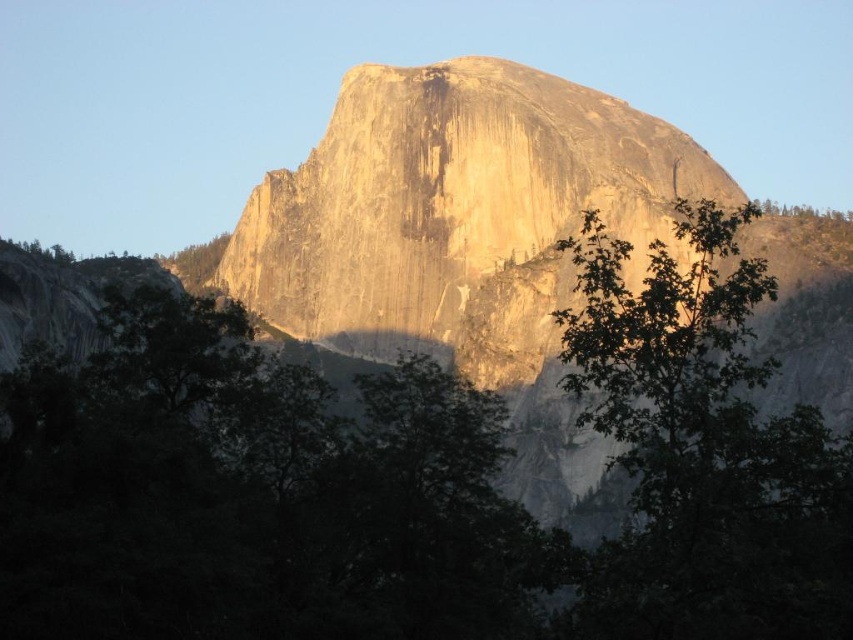
You are a photographer planning to capture the yellowish rock at center and the green leafy tree at right in a single frame. Based on their sizes, which object would occupy more space in the photo?

The yellowish rock at center would occupy more space in the photo since its width surpasses that of the green leafy tree at right according to the description.

You are standing in front of the majestic natural landscape with the large granite dome mountain. You notice a green leafy tree at center. Based on its position, can you determine if the tree is closer to you or further away compared to the mountain?

The green leafy tree at center is located at point coordinates that place it closer to the viewer than the mountain, so the tree is closer.

You are a hiker standing at the base of Half Dome in Yosemite National Park. You notice a yellowish rock at center and a green leafy tree at right in your view. Which object appears taller from your vantage point?

The yellowish rock at center appears taller than the green leafy tree at right from your vantage point because the yellowish rock at center has a greater height compared to green leafy tree at right.